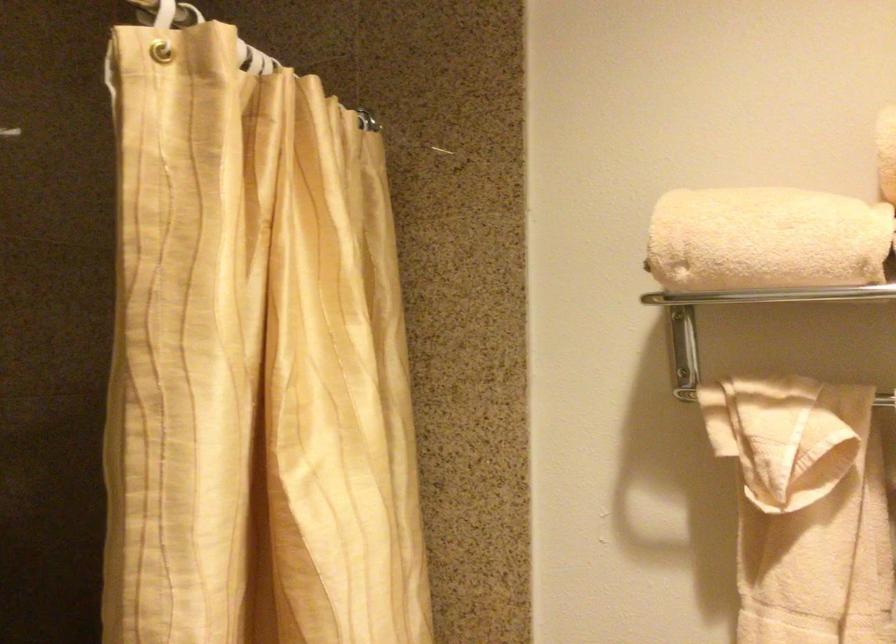
This screenshot has height=644, width=896. I want to click on hanging beige towel, so click(x=793, y=486).